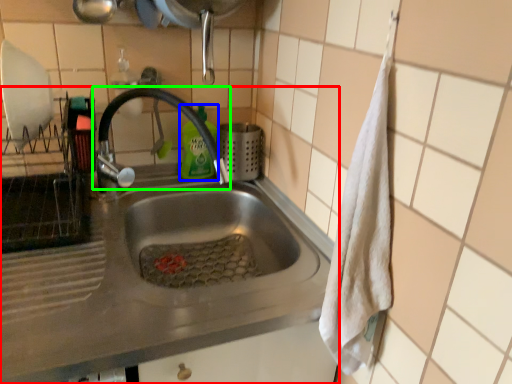
Question: Estimate the real-world distances between objects in this image. Which object is farther from sink (highlighted by a red box), cleaning product (highlighted by a blue box) or tap (highlighted by a green box)?

Choices:
 (A) cleaning product
 (B) tap

Answer: (A)